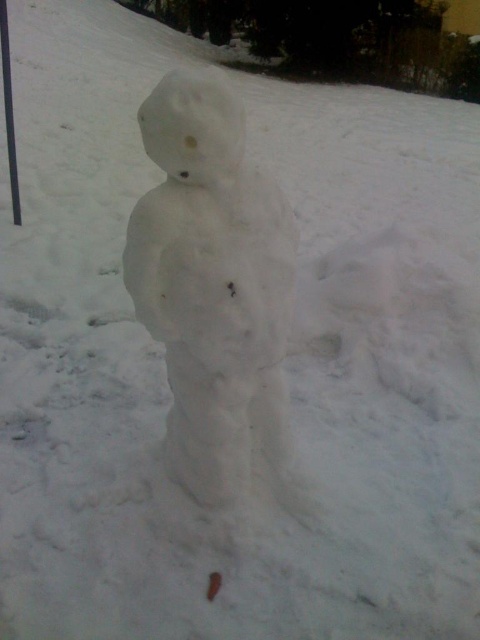
Is the position of white fluffy snowman at center less distant than that of white snowman at center?

Yes, white fluffy snowman at center is in front of white snowman at center.

Is white fluffy snowman at center taller than white snowman at center?

Correct, white fluffy snowman at center is much taller as white snowman at center.

Is point (262, 332) positioned before point (3, 61)?

That is True.

At what (x,y) coordinates should I click in order to perform the action: click on white fluffy snowman at center. Please return your answer as a coordinate pair (x, y). Looking at the image, I should click on (213, 284).